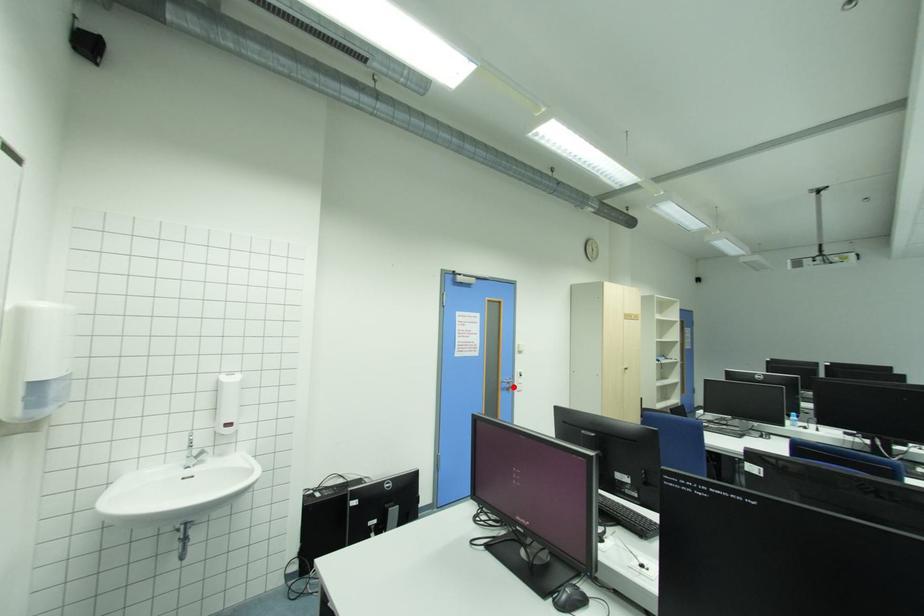
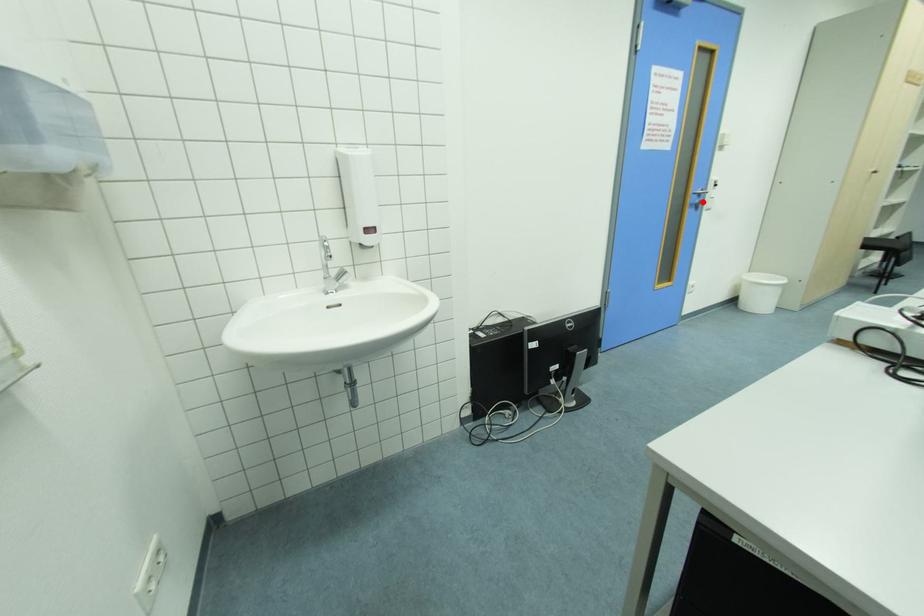
I am providing you with two images of the same scene from different viewpoints. A red point is marked on the first image and another point is marked on the second image. Are the points marked in image1 and image2 representing the same 3D position?

Yes